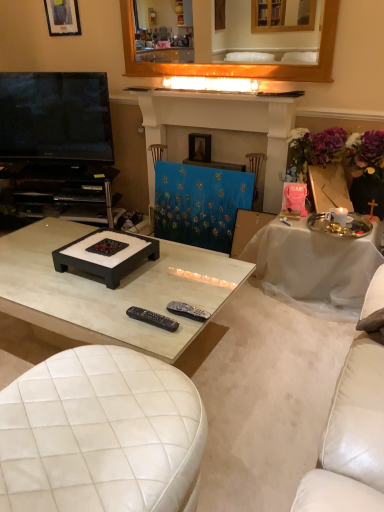
At what (x,y) coordinates should I click in order to perform the action: click on vacant area on top of white leather ottoman at lower left (from a real-world perspective). Please return your answer as a coordinate pair (x, y). This screenshot has width=384, height=512. Looking at the image, I should click on (88, 414).